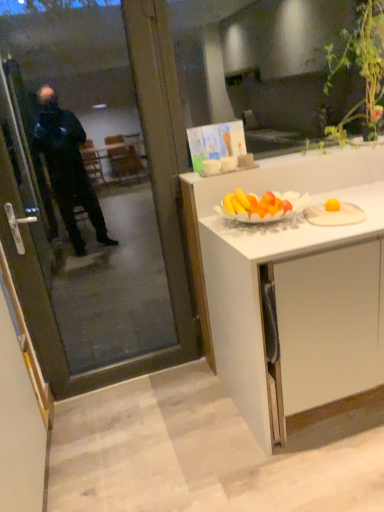
What is the approximate height of white wooden plate at right?

The height of white wooden plate at right is 3.68 inches.

Identify the location of green leafy plant at upper right. The width and height of the screenshot is (384, 512). (361, 69).

Is point (361, 60) farther from viewer compared to point (35, 48)?

No.

Is green leafy plant at upper right not inside transparent glass screen door at left?

Yes, green leafy plant at upper right is not within transparent glass screen door at left.

Considering the relative positions of green leafy plant at upper right and transparent glass screen door at left in the image provided, is green leafy plant at upper right to the left of transparent glass screen door at left from the viewer's perspective?

No, green leafy plant at upper right is not to the left of transparent glass screen door at left.

Is green leafy plant at upper right shorter than transparent glass screen door at left?

Yes, green leafy plant at upper right is shorter than transparent glass screen door at left.

Considering the sizes of objects transparent glass screen door at left and white matte cabinet at center in the image provided, who is thinner, transparent glass screen door at left or white matte cabinet at center?

transparent glass screen door at left is thinner.

In the scene shown: From the image's perspective, is transparent glass screen door at left above white matte cabinet at center?

Indeed, from the image's perspective, transparent glass screen door at left is shown above white matte cabinet at center.

Image resolution: width=384 pixels, height=512 pixels. Find the location of `screen door on the left of white matte cabinet at center`. screen door on the left of white matte cabinet at center is located at coordinates (99, 192).

From the picture: Is transparent glass screen door at left with white matte cabinet at center?

transparent glass screen door at left is not next to white matte cabinet at center, and they're not touching.

Based on the photo, considering the positions of objects white matte cabinet at center and green leafy plant at upper right in the image provided, who is more to the left, white matte cabinet at center or green leafy plant at upper right?

From the viewer's perspective, white matte cabinet at center appears more on the left side.

Could you tell me if white matte cabinet at center is facing green leafy plant at upper right?

No, white matte cabinet at center is not oriented towards green leafy plant at upper right.

Which object is closer to the camera, white matte cabinet at center or green leafy plant at upper right?

white matte cabinet at center is more forward.

Is white matte cabinet at center positioned beyond the bounds of green leafy plant at upper right?

Yes.

Considering the relative positions of white matte cabinet at center and white wooden plate at right in the image provided, is white matte cabinet at center behind white wooden plate at right?

No, it is in front of white wooden plate at right.

Is white matte cabinet at center taller than white wooden plate at right?

A: Indeed, white matte cabinet at center has a greater height compared to white wooden plate at right.

This screenshot has width=384, height=512. In the image, there is a green leafy plant at upper right. Find the location of `plate below it (from a real-world perspective)`. plate below it (from a real-world perspective) is located at coordinates (334, 214).

What's the angular difference between white wooden plate at right and green leafy plant at upper right's facing directions?

23.4 degrees.

Based on the photo, in the image, is white wooden plate at right positioned in front of or behind green leafy plant at upper right?

In the image, white wooden plate at right appears in front of green leafy plant at upper right.

Who is shorter, white wooden plate at right or transparent glass screen door at left?

white wooden plate at right.

Measure the distance from white wooden plate at right to transparent glass screen door at left.

white wooden plate at right is 6.49 feet from transparent glass screen door at left.

Is point (317, 215) closer or farther from the camera than point (46, 196)?

Clearly, point (317, 215) is closer to the camera than point (46, 196).

Who is more distant, white wooden plate at right or transparent glass screen door at left?

Positioned behind is white wooden plate at right.

From a real-world perspective, relative to white wooden plate at right, is transparent glass screen door at left vertically above or below?

Clearly, from a real-world perspective, transparent glass screen door at left is above white wooden plate at right.

Who is smaller, transparent glass screen door at left or white wooden plate at right?

white wooden plate at right.

Looking at their sizes, would you say transparent glass screen door at left is wider or thinner than white wooden plate at right?

transparent glass screen door at left is thinner than white wooden plate at right.

This screenshot has width=384, height=512. Identify the location of screen door in front of the green leafy plant at upper right. (99, 192).

Where is `screen door above the white matte cabinet at center (from the image's perspective)`? The width and height of the screenshot is (384, 512). screen door above the white matte cabinet at center (from the image's perspective) is located at coordinates (99, 192).

In the scene shown: When comparing their distances from white matte cabinet at center, does transparent glass screen door at left or green leafy plant at upper right seem further?

transparent glass screen door at left is positioned further to the anchor white matte cabinet at center.

Based on their spatial positions, is transparent glass screen door at left or green leafy plant at upper right further from white wooden plate at right?

transparent glass screen door at left is further to white wooden plate at right.

When comparing their distances from green leafy plant at upper right, does white matte cabinet at center or white wooden plate at right seem closer?

white matte cabinet at center is closer to green leafy plant at upper right.

When comparing their distances from green leafy plant at upper right, does white matte cabinet at center or transparent glass screen door at left seem further?

transparent glass screen door at left lies further to green leafy plant at upper right than the other object.

Considering their positions, is white wooden plate at right positioned further to transparent glass screen door at left than white matte cabinet at center?

white wooden plate at right.

Considering their positions, is green leafy plant at upper right positioned further to white wooden plate at right than transparent glass screen door at left?

transparent glass screen door at left is further to white wooden plate at right.

From the image, which object appears to be farther from white matte cabinet at center, green leafy plant at upper right or transparent glass screen door at left?

transparent glass screen door at left.

When comparing their distances from green leafy plant at upper right, does white wooden plate at right or white matte cabinet at center seem closer?

white matte cabinet at center.

The image size is (384, 512). I want to click on cabinetry located between transparent glass screen door at left and green leafy plant at upper right in the left-right direction, so click(x=292, y=287).

This screenshot has width=384, height=512. Find the location of `plate between transparent glass screen door at left and white matte cabinet at center from left to right`. plate between transparent glass screen door at left and white matte cabinet at center from left to right is located at coordinates (334, 214).

Image resolution: width=384 pixels, height=512 pixels. I want to click on plate situated between transparent glass screen door at left and green leafy plant at upper right from left to right, so click(x=334, y=214).

Find the location of a particular element. The height and width of the screenshot is (512, 384). plate that lies between green leafy plant at upper right and white matte cabinet at center from top to bottom is located at coordinates (334, 214).